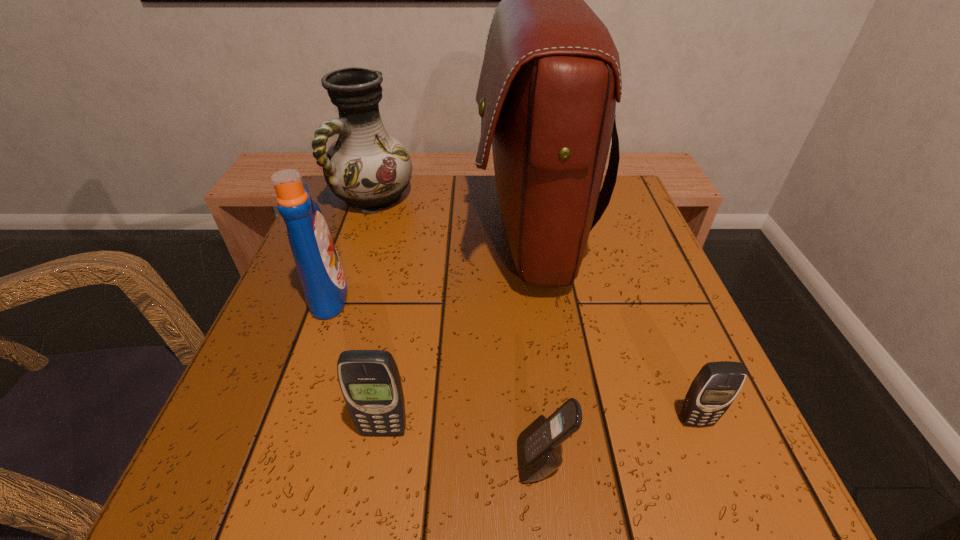
Image resolution: width=960 pixels, height=540 pixels. I want to click on object at the near edge, so click(539, 453).

Find the location of a particular element. The width and height of the screenshot is (960, 540). vase that is positioned at the left edge is located at coordinates (368, 169).

This screenshot has height=540, width=960. In order to click on detergent that is at the left edge in this screenshot , I will do `click(319, 268)`.

At what (x,y) coordinates should I click in order to perform the action: click on satchel at the right edge. Please return your answer as a coordinate pair (x, y). The image size is (960, 540). Looking at the image, I should click on pyautogui.click(x=550, y=78).

The image size is (960, 540). What are the coordinates of `cellular telephone present at the right edge` in the screenshot? It's located at (713, 390).

Image resolution: width=960 pixels, height=540 pixels. Find the location of `object that is at the far left corner`. object that is at the far left corner is located at coordinates (368, 169).

At what (x,y) coordinates should I click in order to perform the action: click on object that is at the far right corner. Please return your answer as a coordinate pair (x, y). Image resolution: width=960 pixels, height=540 pixels. Looking at the image, I should click on (550, 78).

At what (x,y) coordinates should I click in order to perform the action: click on free space at the far edge of the desktop. Please return your answer as a coordinate pair (x, y). This screenshot has height=540, width=960. Looking at the image, I should click on (462, 187).

In the image, there is a desktop. Identify the location of free space at the near edge. The width and height of the screenshot is (960, 540). (431, 497).

In the image, there is a desktop. What are the coordinates of `free region at the left edge` in the screenshot? It's located at (271, 350).